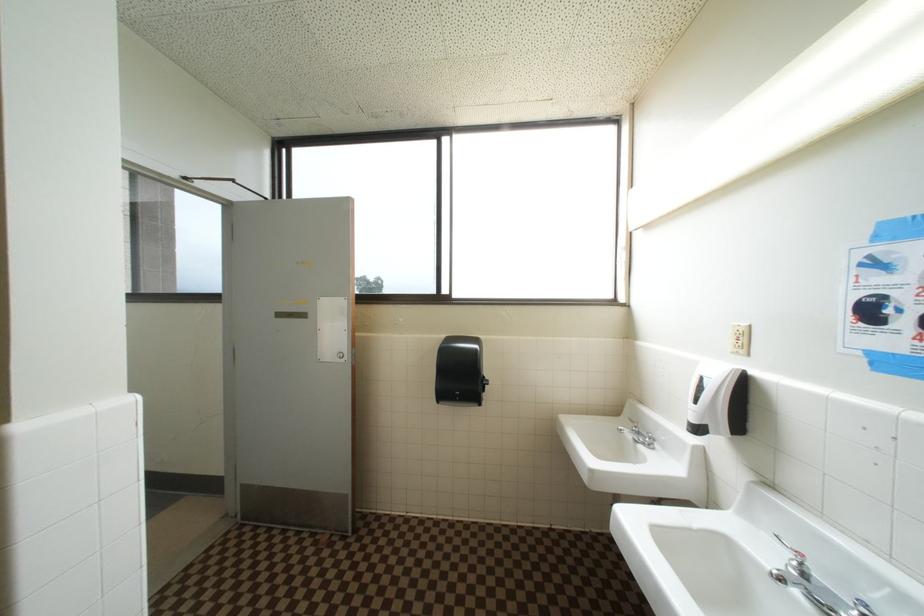
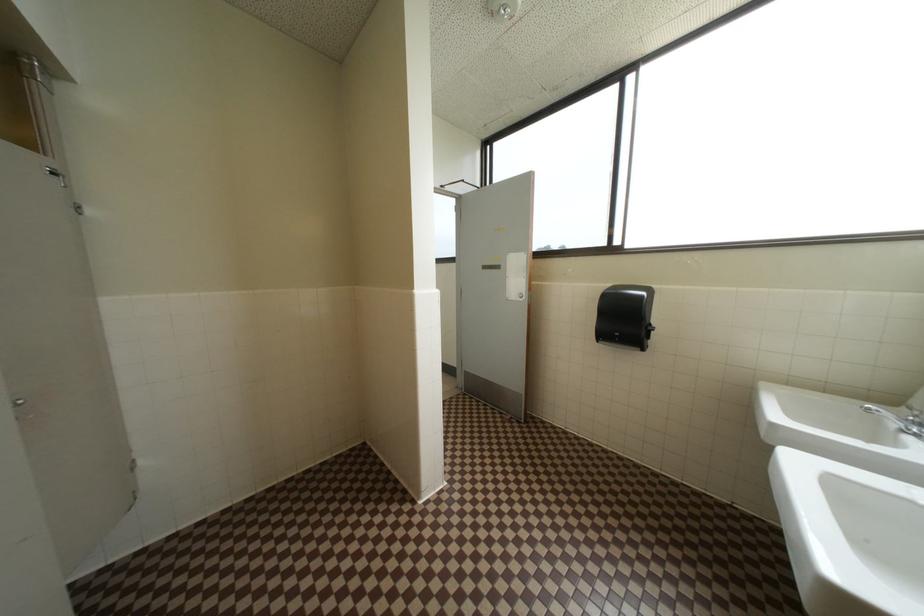
Question: The first image is from the beginning of the video and the second image is from the end. How did the camera likely rotate when shooting the video?

Choices:
 (A) Left
 (B) Right
 (C) Up
 (D) Down

Answer: (A)